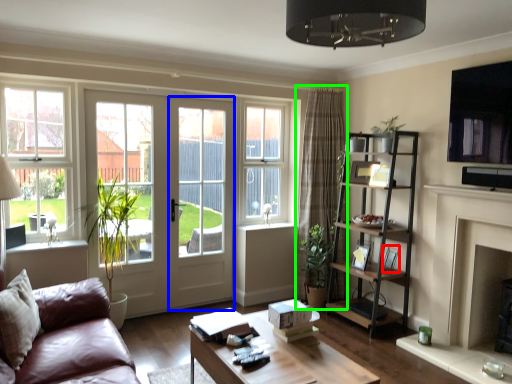
Question: Which object is the farthest from picture frame (highlighted by a red box)? Choose among these: screen door (highlighted by a blue box) or curtain (highlighted by a green box).

Choices:
 (A) screen door
 (B) curtain

Answer: (A)